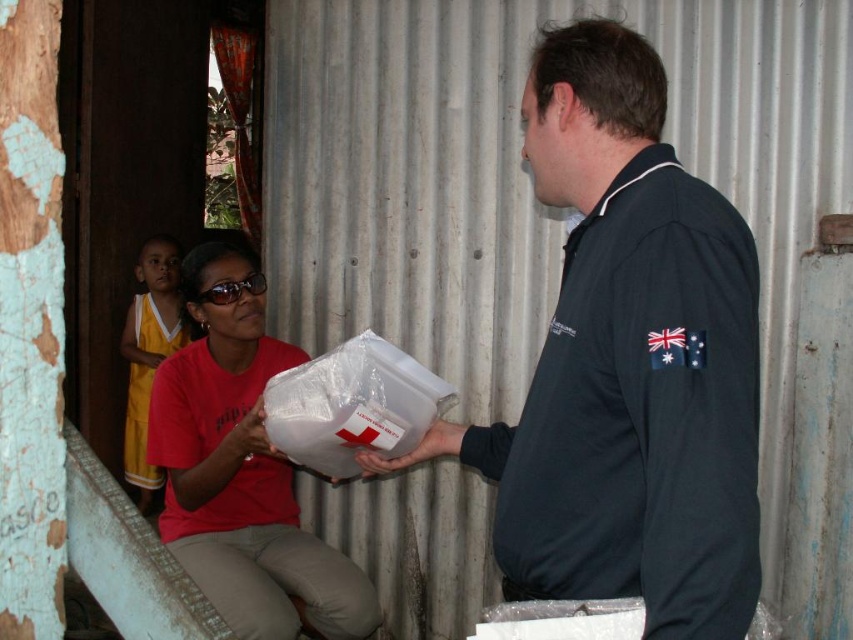
Does dark blue polo shirt at center have a smaller size compared to yellow jersey at left?

Correct, dark blue polo shirt at center occupies less space than yellow jersey at left.

The image size is (853, 640). In order to click on dark blue polo shirt at center in this screenshot , I will do `click(627, 364)`.

Find the location of a particular element. The width and height of the screenshot is (853, 640). dark blue polo shirt at center is located at coordinates (627, 364).